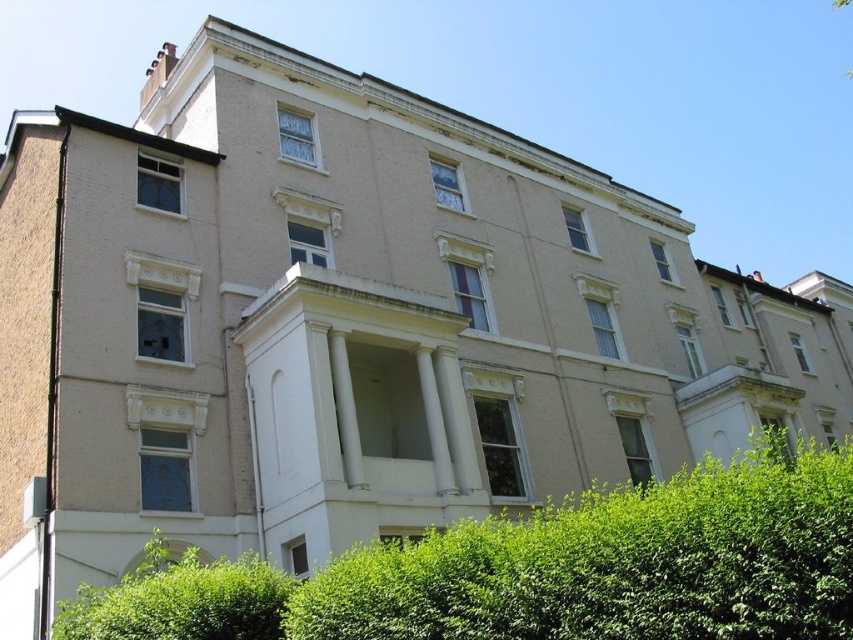
You are standing 15 meters away from the multi story residential building. You see the green leafy hedge at lower center. Can you walk towards the building without stepping on the hedge?

The green leafy hedge at lower center is 18.50 meters away from the viewer. Since you are standing 15 meters away from the building, you can walk towards the building without stepping on the hedge as the hedge is further away from you than the building.

You are standing in front of the residential building. There is a specific point marked at coordinates (618, 563). Based on the image description, what object is located at that point?

The point at coordinates (618, 563) corresponds to the green leafy hedge at lower center.